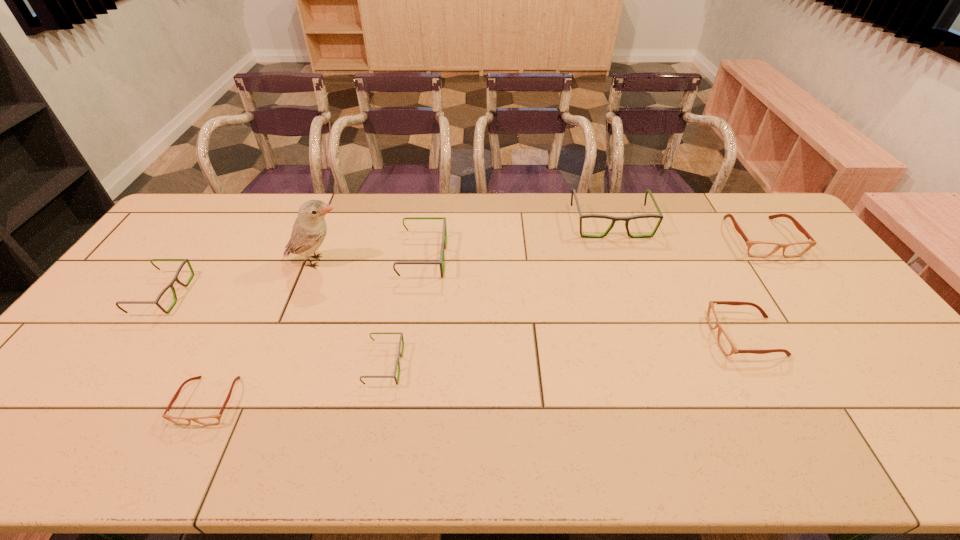
Identify the location of white bird. The width and height of the screenshot is (960, 540). (309, 230).

You are a GUI agent. You are given a task and a screenshot of the screen. Output one action in this format:
    pyautogui.click(x=<x>, y=<y>)
    Task: Click on the tallest object
    Image resolution: width=960 pixels, height=540 pixels.
    Given the screenshot: What is the action you would take?
    pyautogui.click(x=309, y=230)

You are a GUI agent. You are given a task and a screenshot of the screen. Output one action in this format:
    pyautogui.click(x=<x>, y=<y>)
    Task: Click on the tallest spectacles
    
    Given the screenshot: What is the action you would take?
    pyautogui.click(x=614, y=219)

Where is `the biggest black spectacles`? the biggest black spectacles is located at coordinates (614, 219).

Where is `the second biggest black spectacles`? The width and height of the screenshot is (960, 540). the second biggest black spectacles is located at coordinates (441, 262).

Identify the location of the rightmost object. (758, 249).

Locate an element on the screen. The width and height of the screenshot is (960, 540). the farthest brown spectacles is located at coordinates (758, 249).

This screenshot has width=960, height=540. I want to click on the leftmost black spectacles, so click(x=175, y=278).

The height and width of the screenshot is (540, 960). Find the location of `the leftmost object`. the leftmost object is located at coordinates (175, 278).

Locate an element on the screen. This screenshot has height=540, width=960. the second object from right to left is located at coordinates (726, 345).